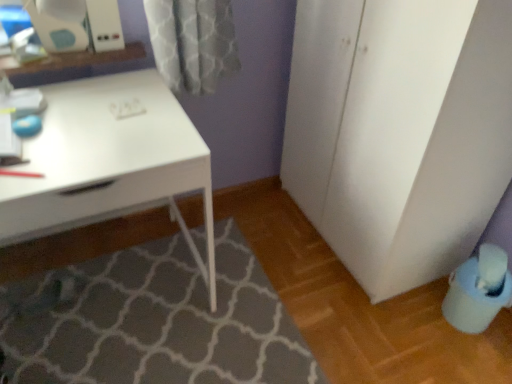
Question: Is blue plastic swivel chair at lower right next to white matte cabinet at right?

Choices:
 (A) yes
 (B) no

Answer: (B)

Question: Could white matte cabinet at right be considered to be inside blue plastic swivel chair at lower right?

Choices:
 (A) no
 (B) yes

Answer: (A)

Question: Can we say blue plastic swivel chair at lower right lies outside white matte cabinet at right?

Choices:
 (A) no
 (B) yes

Answer: (B)

Question: Is blue plastic swivel chair at lower right further to the viewer compared to white matte cabinet at right?

Choices:
 (A) yes
 (B) no

Answer: (A)

Question: From a real-world perspective, is blue plastic swivel chair at lower right on white matte cabinet at right?

Choices:
 (A) no
 (B) yes

Answer: (A)

Question: Can you confirm if blue plastic swivel chair at lower right is positioned to the right of white matte cabinet at right?

Choices:
 (A) no
 (B) yes

Answer: (B)

Question: Does white matte cabinet at right come in front of gray textured bath mat at lower center?

Choices:
 (A) yes
 (B) no

Answer: (A)

Question: Is white matte cabinet at right outside of gray textured bath mat at lower center?

Choices:
 (A) no
 (B) yes

Answer: (B)

Question: From a real-world perspective, is white matte cabinet at right physically above gray textured bath mat at lower center?

Choices:
 (A) no
 (B) yes

Answer: (B)

Question: Is white matte cabinet at right smaller than gray textured bath mat at lower center?

Choices:
 (A) yes
 (B) no

Answer: (B)

Question: Is white matte cabinet at right next to gray textured bath mat at lower center and touching it?

Choices:
 (A) yes
 (B) no

Answer: (B)

Question: Is white matte cabinet at right shorter than gray textured bath mat at lower center?

Choices:
 (A) yes
 (B) no

Answer: (B)

Question: From the image's perspective, is white glossy desk at upper left beneath white matte cabinet at right?

Choices:
 (A) yes
 (B) no

Answer: (A)